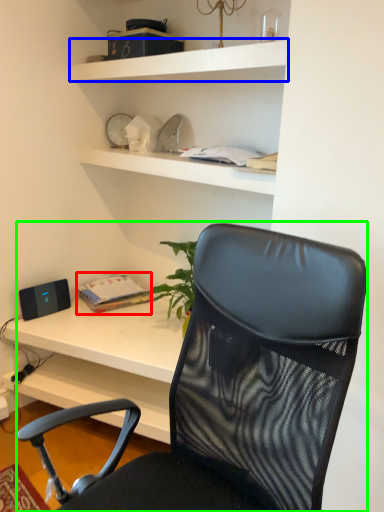
Question: Estimate the real-world distances between objects in this image. Which object is closer to book (highlighted by a red box), shelf (highlighted by a blue box) or chair (highlighted by a green box)?

Choices:
 (A) shelf
 (B) chair

Answer: (A)